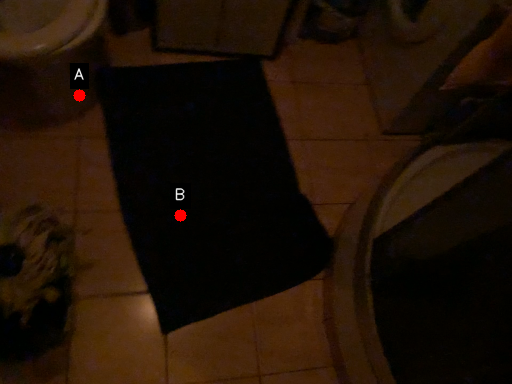
Question: Two points are circled on the image, labeled by A and B beside each circle. Among these points, which one is nearest to the camera?

Choices:
 (A) A is closer
 (B) B is closer

Answer: (B)